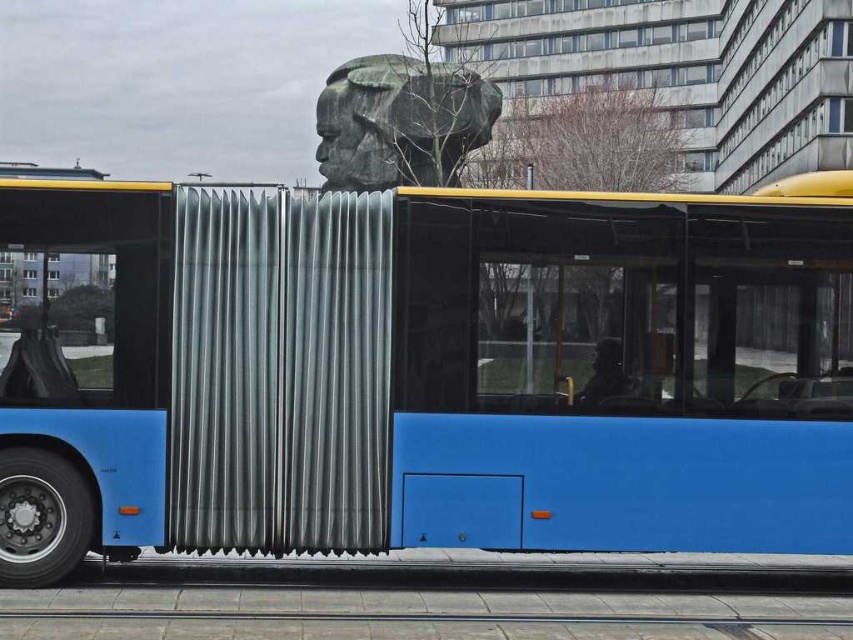
Does point (521, 451) lie behind point (332, 77)?

That is False.

Between point (534, 289) and point (489, 113), which one is positioned behind?

Positioned behind is point (489, 113).

You are a GUI agent. You are given a task and a screenshot of the screen. Output one action in this format:
    pyautogui.click(x=<x>, y=<y>)
    Task: Click on the blue matte bus at center
    Image resolution: width=853 pixels, height=640 pixels.
    Given the screenshot: What is the action you would take?
    pyautogui.click(x=434, y=372)